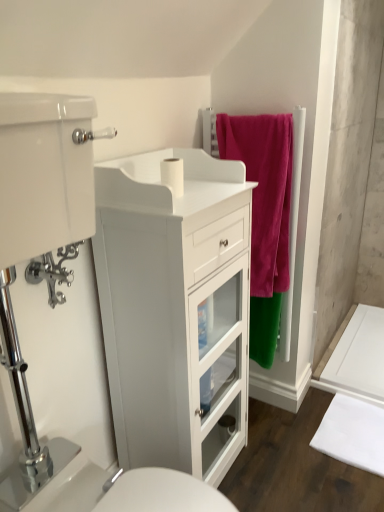
In order to click on free spot above white fabric bath mat at lower right (from a real-world perspective) in this screenshot , I will do `click(358, 431)`.